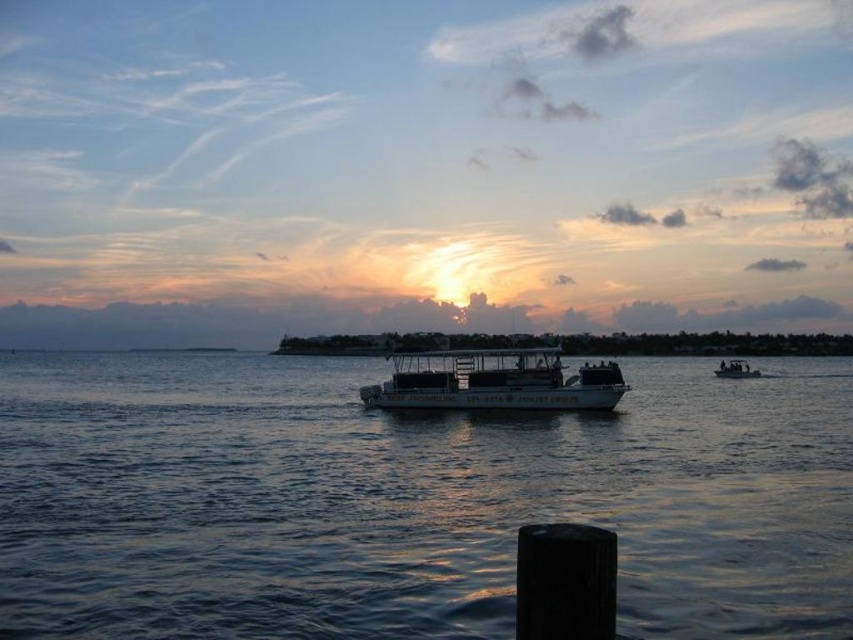
Is dark blue water at center closer to the viewer compared to white matte boat at center?

Yes, dark blue water at center is in front of white matte boat at center.

Which is behind, point (291, 429) or point (543, 355)?

Point (543, 355)

Image resolution: width=853 pixels, height=640 pixels. Describe the element at coordinates (409, 500) in the screenshot. I see `dark blue water at center` at that location.

Locate an element on the screen. dark blue water at center is located at coordinates (409, 500).

Is point (404, 387) positioned after point (746, 364)?

That is False.

Can you confirm if white matte boat at center is wider than dark gray metallic boat at center?

No, white matte boat at center is not wider than dark gray metallic boat at center.

In order to click on white matte boat at center in this screenshot , I will do `click(494, 381)`.

The width and height of the screenshot is (853, 640). What do you see at coordinates (409, 500) in the screenshot? I see `dark blue water at center` at bounding box center [409, 500].

In the scene shown: Is dark blue water at center wider than dark gray metallic boat at center?

Indeed, dark blue water at center has a greater width compared to dark gray metallic boat at center.

Who is more distant from viewer, (x=33, y=563) or (x=721, y=371)?

The point (x=721, y=371) is behind.

Locate an element on the screen. Image resolution: width=853 pixels, height=640 pixels. dark blue water at center is located at coordinates (409, 500).